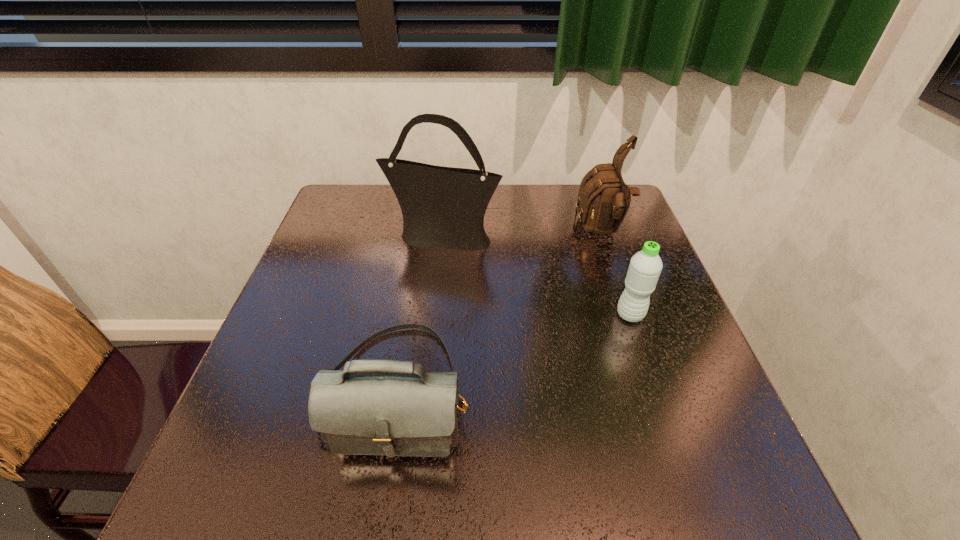
Locate an element on the screen. This screenshot has width=960, height=540. free space that satisfies the following two spatial constraints: 1. on the back side of the nearest shoulder bag; 2. on the right side of the third farthest object is located at coordinates (411, 315).

The width and height of the screenshot is (960, 540). Identify the location of vacant space that satisfies the following two spatial constraints: 1. on the back side of the shortest shoulder bag; 2. on the right side of the tallest shoulder bag. (423, 237).